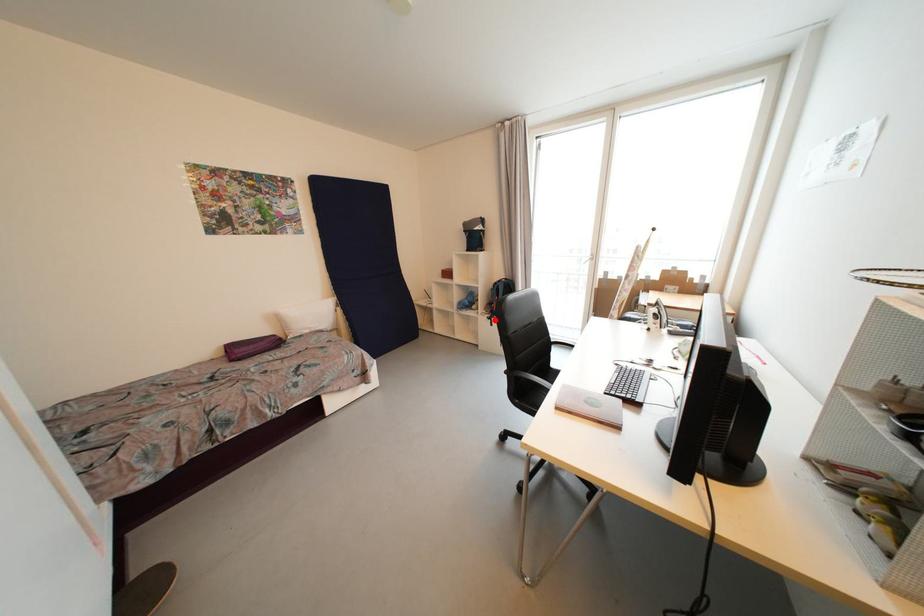
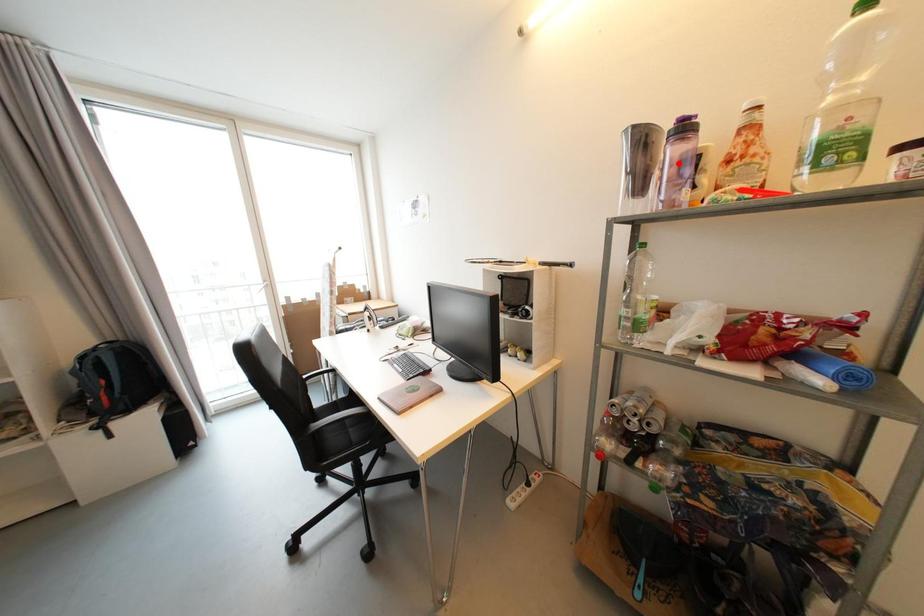
I am providing you with two images of the same scene from different viewpoints. A red point is marked on the first image and another point is marked on the second image. Do the highlighted points in image1 and image2 indicate the same real-world spot?

No